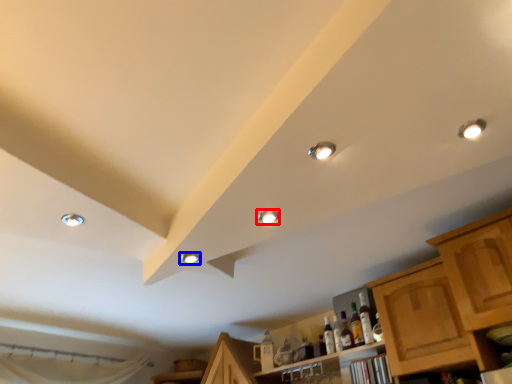
Question: Which point is closer to the camera, droplight (highlighted by a red box) or droplight (highlighted by a blue box)?

Choices:
 (A) droplight
 (B) droplight

Answer: (A)